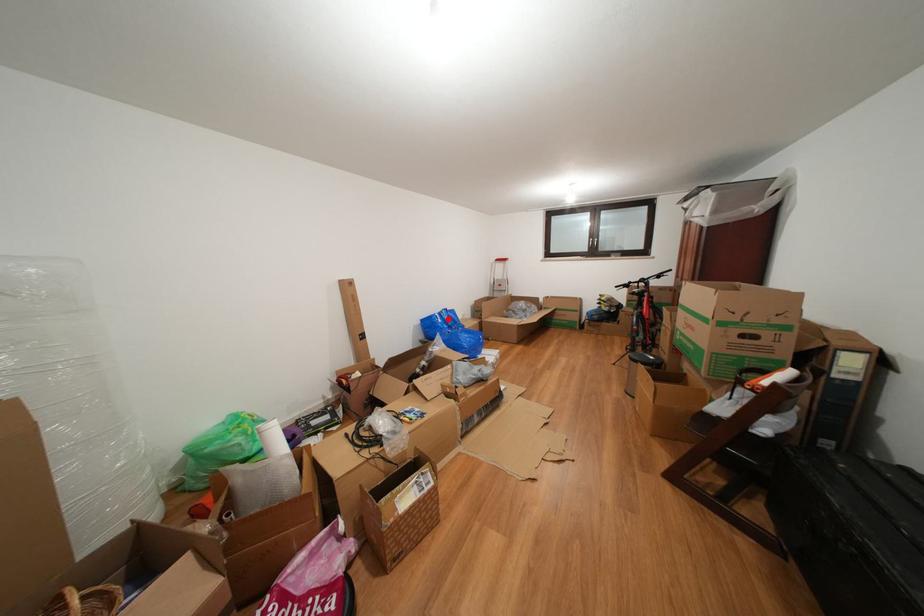
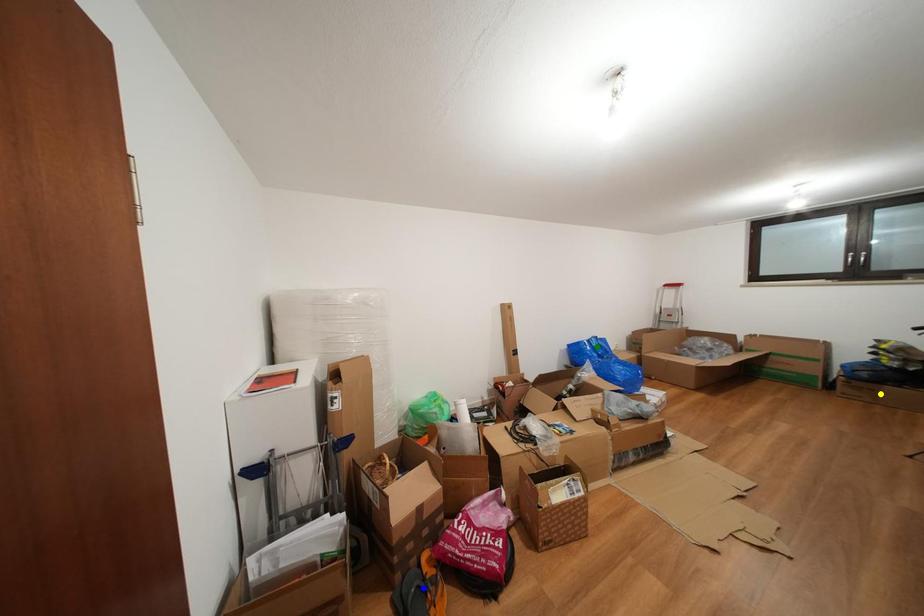
Question: I am providing you with two images of the same scene from different viewpoints. A red point is marked on the first image. You are given multiple points on the second image. Can you choose the point in image 2 that corresponds to the point in image 1?

Choices:
 (A) yellow point
 (B) green point
 (C) blue point

Answer: (B)